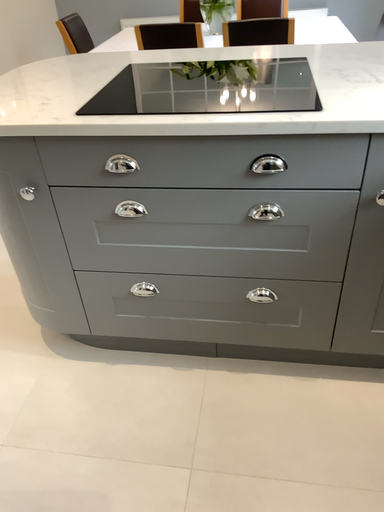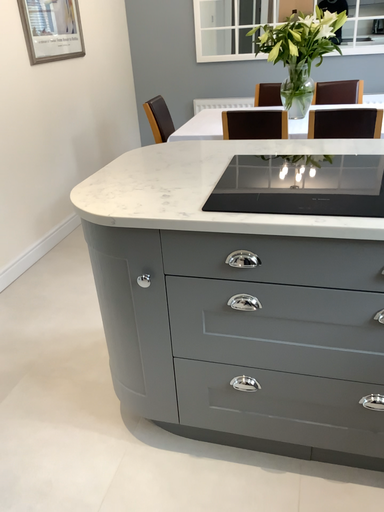
Question: Which way did the camera rotate in the video?

Choices:
 (A) rotated upward
 (B) rotated downward

Answer: (A)